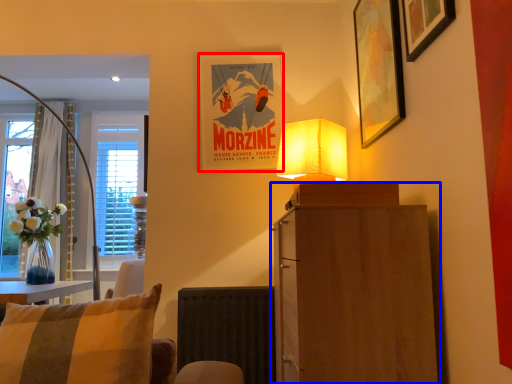
Question: Which point is closer to the camera, picture frame (highlighted by a red box) or cabinetry (highlighted by a blue box)?

Choices:
 (A) picture frame
 (B) cabinetry

Answer: (B)